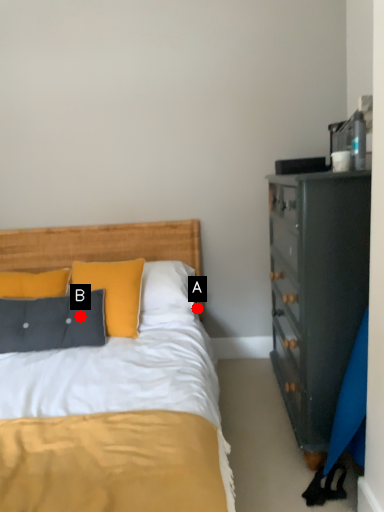
Question: Two points are circled on the image, labeled by A and B beside each circle. Which point appears closest to the camera in this image?

Choices:
 (A) A is closer
 (B) B is closer

Answer: (B)